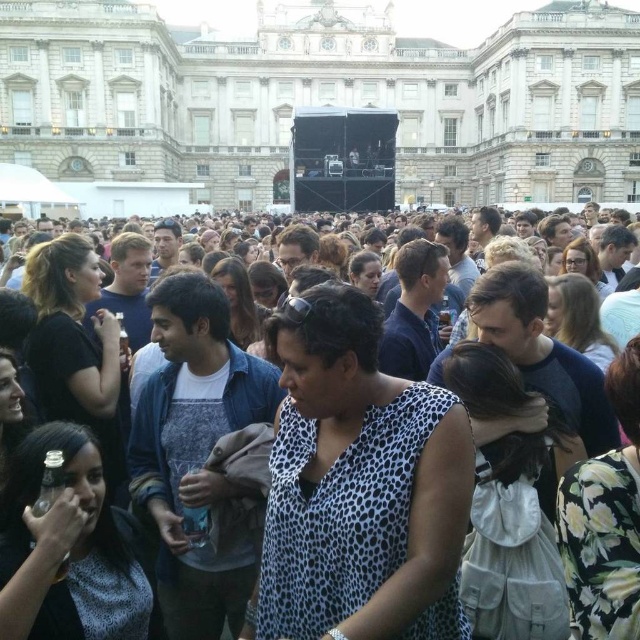
You are standing in the crowd at the festival and want to take a photo of both the point at coordinates (x=388, y=48) and the point at coordinates (x=262, y=353). Which point should you focus on first to ensure both are in focus?

You should focus on the point at coordinates (x=388, y=48) first because it is closer to you than the point at coordinates (x=262, y=353). This way, both points will be in focus as the camera adjusts the depth of field.

Based on the coordinates provided, what is the primary structure located at point (323, 99) in the image?

The point (323, 99) indicates the location of the white stone building at center.

You are standing in the crowd at the lively outdoor event near the white stone building at center. You want to take a photo of the building with your smartphone. Considering the distance, will you need to zoom in to capture the entire building in the frame?

The white stone building at center is 329.61 feet away from viewer. At this distance, you would likely need to zoom in to ensure the entire building fits within the smartphone camera frame.